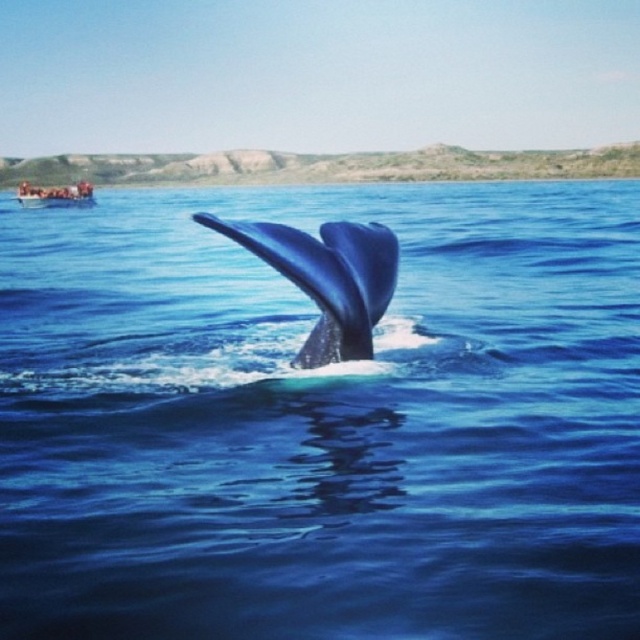
Question: Which object appears farthest from the camera in this image?

Choices:
 (A) wooden boat at upper left
 (B) shiny blue whale at center
 (C) blue smooth water at center

Answer: (A)

Question: Is blue smooth water at center bigger than shiny blue whale at center?

Choices:
 (A) yes
 (B) no

Answer: (A)

Question: Is blue smooth water at center below shiny blue whale at center?

Choices:
 (A) yes
 (B) no

Answer: (B)

Question: Estimate the real-world distances between objects in this image. Which object is farther from the shiny blue whale at center?

Choices:
 (A) wooden boat at upper left
 (B) blue smooth water at center

Answer: (A)

Question: Which point is closer to the camera?

Choices:
 (A) (60, 195)
 (B) (346, 228)
 (C) (572, 221)

Answer: (B)

Question: Does blue smooth water at center appear under shiny blue whale at center?

Choices:
 (A) no
 (B) yes

Answer: (A)